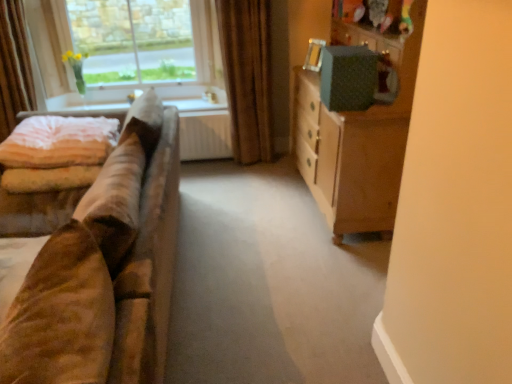
Question: In the image, is velvet curtain at left, the second curtain from the right, positioned in front of or behind green textured cabinet at right?

Choices:
 (A) front
 (B) behind

Answer: (B)

Question: Considering the positions of velvet curtain at left, the second curtain from the right, and green textured cabinet at right in the image, is velvet curtain at left, the second curtain from the right, taller or shorter than green textured cabinet at right?

Choices:
 (A) short
 (B) tall

Answer: (A)

Question: Based on their relative distances, which object is nearer to the velvet curtain at left, positioned as the first curtain in left-to-right order?

Choices:
 (A) brown velvet curtain at upper center, which is the second curtain from left to right
 (B) white fabric at upper left
 (C) suede brown couch at left
 (D) green textured cabinet at right
 (E) clear glass window at upper left

Answer: (E)

Question: Based on their relative distances, which object is nearer to the suede brown couch at left?

Choices:
 (A) velvet curtain at left, the second curtain from the right
 (B) white fabric at upper left
 (C) light pink velvety quilt at left
 (D) brown velvet curtain at upper center, which is the second curtain from left to right
 (E) clear glass window at upper left

Answer: (C)